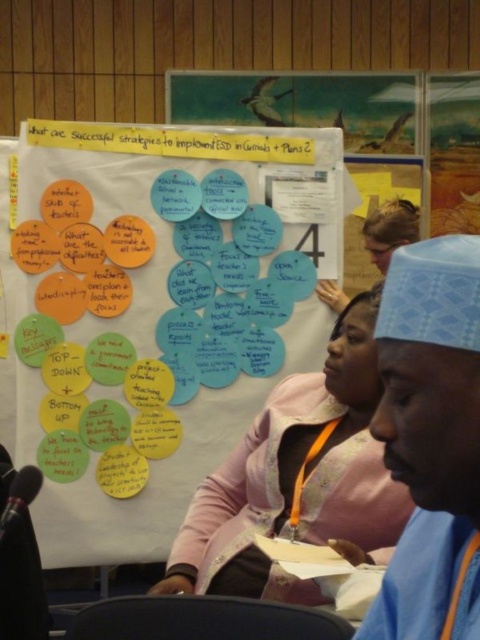
You are an observer looking at the whiteboard. There are yellow paper circles at upper center and a pink fabric jacket at center. Which object is positioned to the right of the other?

The yellow paper circles at upper center is to the left of pink fabric jacket at center, so the pink fabric jacket at center is positioned to the right of the yellow paper circles at upper center.

You are a photographer standing at the front of the room. You want to take a clear photo of the yellow paper circles at upper center. The camera you are using has a minimum focusing distance of 2 meters. Can you take the photo without moving closer?

The distance between the yellow paper circles at upper center and the camera is 2.23 meters, which is greater than the minimum focusing distance of 2 meters. Therefore, you can take the photo without moving closer.